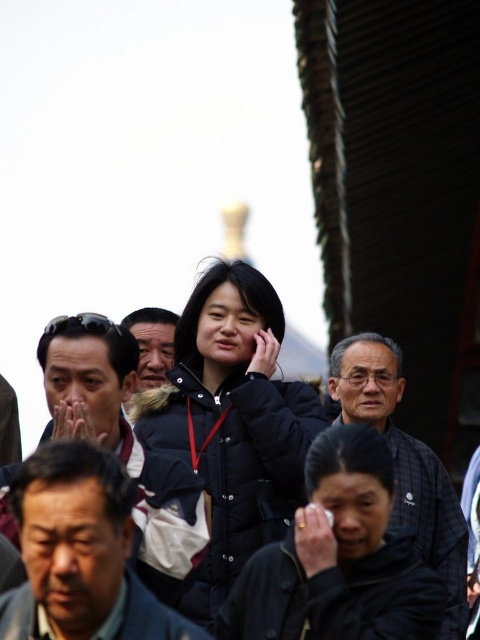
You are a photographer standing 20 meters away from the plaid fabric shirt at center and the dark gray jacket at center. Can you tell if both items are within your camera frame at the same time?

The plaid fabric shirt at center and dark gray jacket at center are 19.74 meters apart. Since you are standing 20 meters away from both items, they are within your camera frame at the same time because the distance between them is less than your distance from them.

In the scene shown: You are a photographer taking a picture of the scene. You notice the plaid fabric shirt at center and the dark gray jacket at center. Which one should you focus on if you want to capture the lower part of the person?

The plaid fabric shirt at center is below the dark gray jacket at center, so you should focus on the plaid fabric shirt at center to capture the lower part of the person.